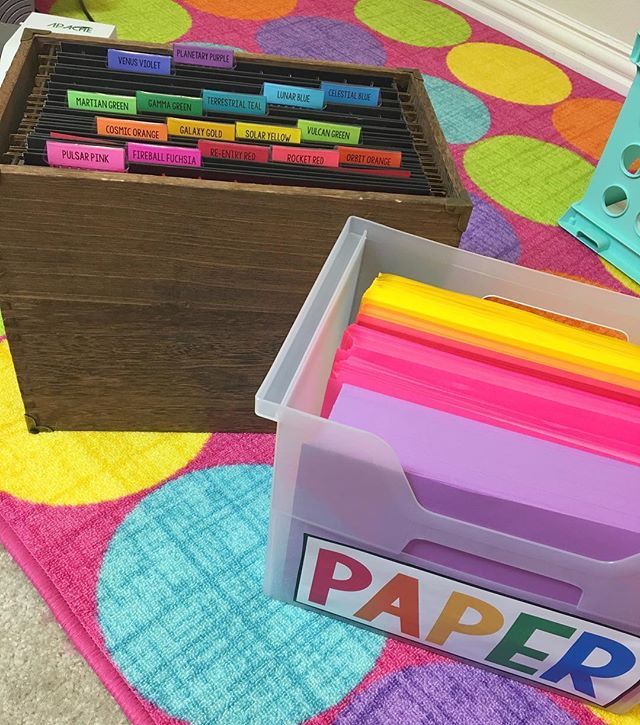
In order to click on wooden boxes in this screenshot , I will do `click(248, 236)`, `click(105, 370)`.